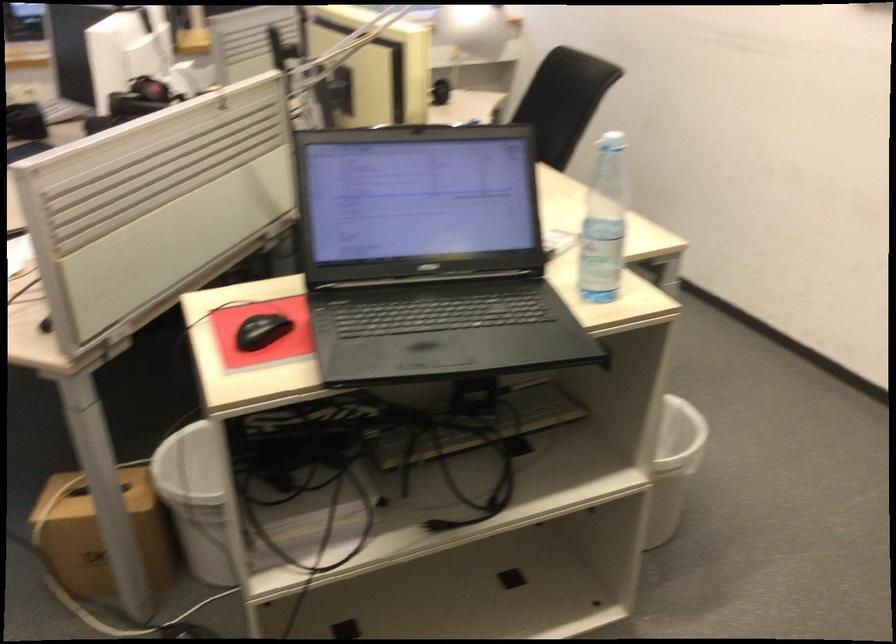
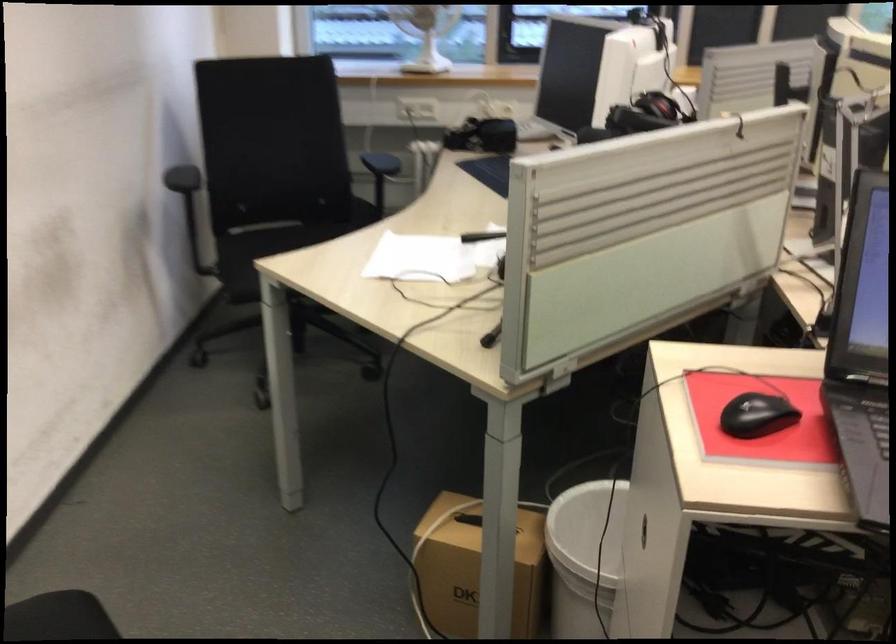
The images are taken continuously from a first-person perspective. In which direction are you moving?

The movement direction of the cameraman is left, forward.